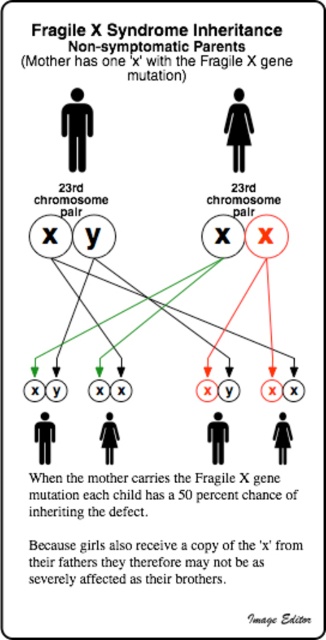
Consider the image. In the diagram explaining Fragile X Syndrome inheritance, you see a black solid figure at center and a matte black figure at center. Which one is bigger in size?

The black solid figure at center is larger in size than the matte black figure at center.

In the Fragile X Syndrome inheritance diagram, you see a black solid figure at center and a matte black figure at center. Which one is positioned to the left?

The black solid figure at center is positioned to the left of the matte black figure at center.